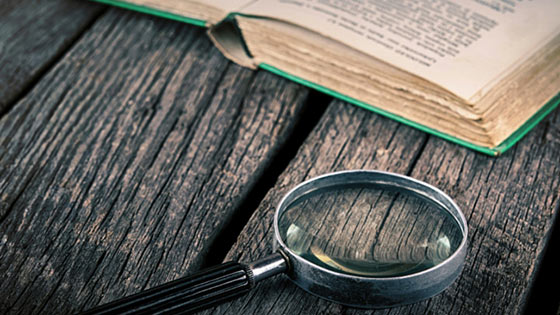
Where is `book spine`? book spine is located at coordinates (236, 42).